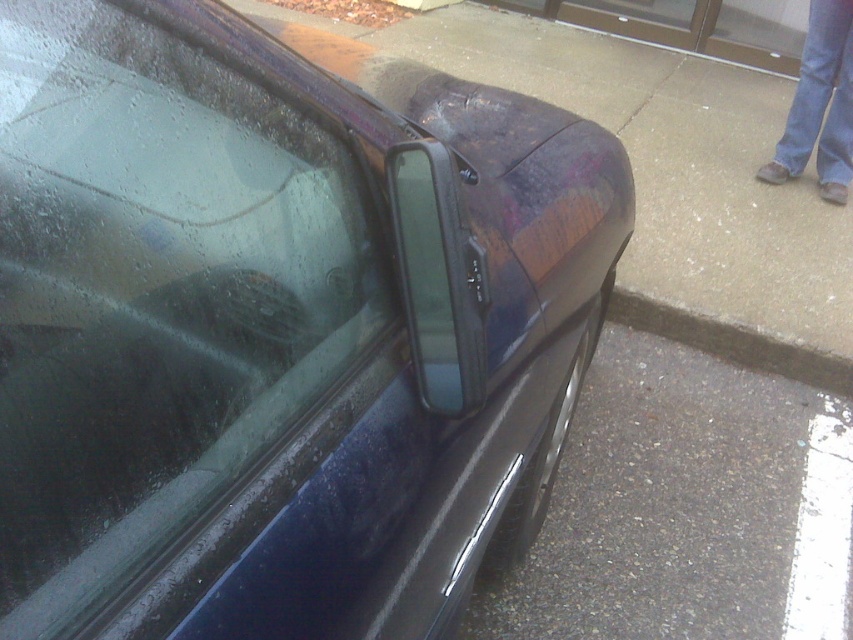
Which of these two, transparent glass windshield at upper left or transparent plastic window at center, stands shorter?

Standing shorter between the two is transparent plastic window at center.

Is transparent glass windshield at upper left wider than transparent plastic window at center?

Indeed, transparent glass windshield at upper left has a greater width compared to transparent plastic window at center.

Locate an element on the screen. transparent glass windshield at upper left is located at coordinates (167, 301).

Which is behind, point (109, 60) or point (844, 627)?

The point (844, 627) is behind.

Is transparent glass windshield at upper left closer to camera compared to gray asphalt at lower right?

Yes, transparent glass windshield at upper left is closer to the viewer.

Locate an element on the screen. The width and height of the screenshot is (853, 640). transparent glass windshield at upper left is located at coordinates (167, 301).

Which of these two, transparent glass windshield at upper left or gray concrete curb at lower right, stands taller?

transparent glass windshield at upper left is taller.

Can you confirm if transparent glass windshield at upper left is taller than gray concrete curb at lower right?

Yes, transparent glass windshield at upper left is taller than gray concrete curb at lower right.

Does point (126, 177) come farther from viewer compared to point (773, 339)?

That is False.

Where is `transparent glass windshield at upper left`? This screenshot has width=853, height=640. transparent glass windshield at upper left is located at coordinates (167, 301).